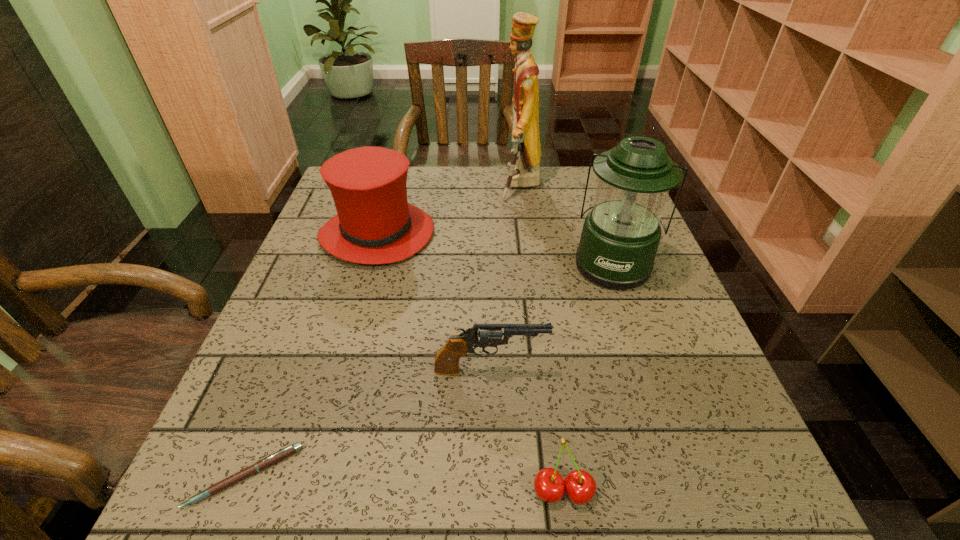
The image size is (960, 540). Identify the location of free space in the image that satisfies the following two spatial constraints: 1. along the barrel of the fourth farthest object; 2. at the nib of the shortest object. (492, 476).

Locate an element on the screen. This screenshot has width=960, height=540. vacant space that satisfies the following two spatial constraints: 1. on the front-facing side of the nutcracker; 2. on the right side of the rightmost object is located at coordinates (531, 264).

The image size is (960, 540). I want to click on blank area in the image that satisfies the following two spatial constraints: 1. along the barrel of the gun; 2. at the nib of the pen, so click(492, 476).